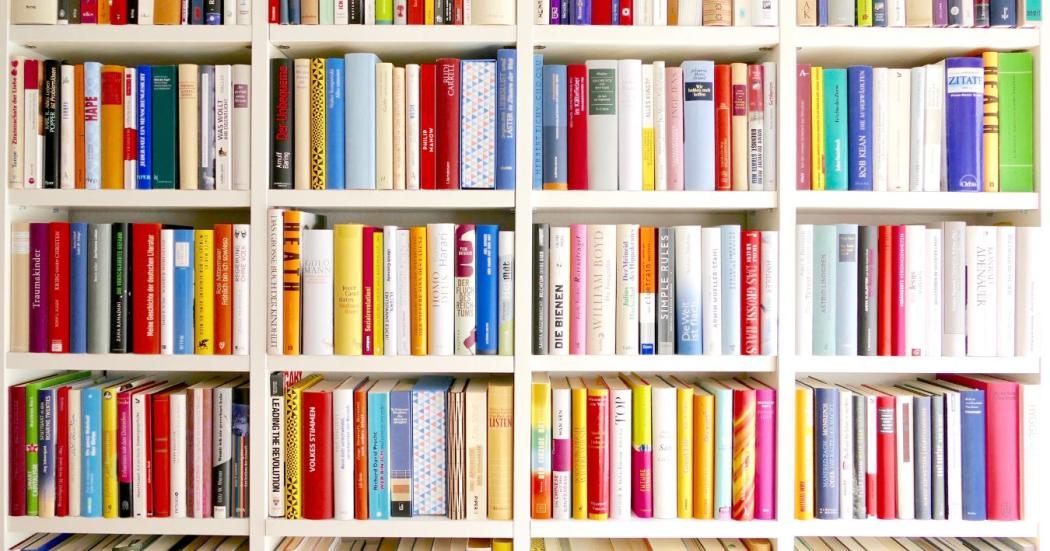
This screenshot has width=1050, height=551. I want to click on 2nd shelve, so click(164, 195), click(422, 198), click(667, 198), click(880, 205).